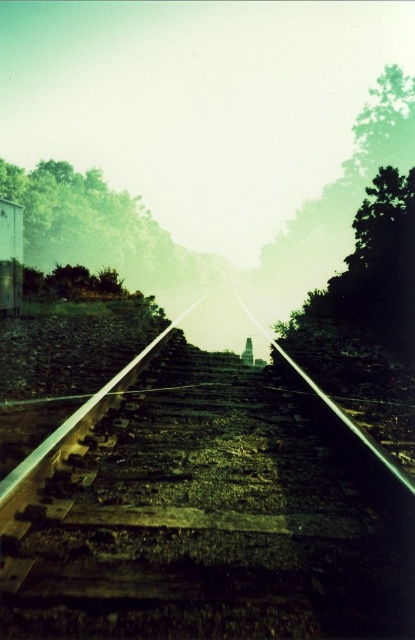
You are a photographer standing at the center of the railway tracks. You want to take a photo that includes both the green leafy tree at upper left and the green leafy tree at right. Which tree should you focus on first to ensure both are in the frame?

The green leafy tree at upper left should be focused on first because the green leafy tree at right is behind it, so adjusting the camera to include the closer tree ensures the background tree is also captured.

You are standing at the starting point of the railway tracks. There is a green leafy tree at right marked by point (373, 268). In which direction should you walk to reach the tree?

The green leafy tree at right is located at point (373, 268), which is to the right side of the scene. To reach it, you should walk towards the right along the railway tracks.

You are standing at the center of the image. Which direction should you walk to reach the smooth metal train track at center?

The smooth metal train track at center is located at point coordinates of (202, 513), so you should walk towards the direction of the coordinates to reach it.